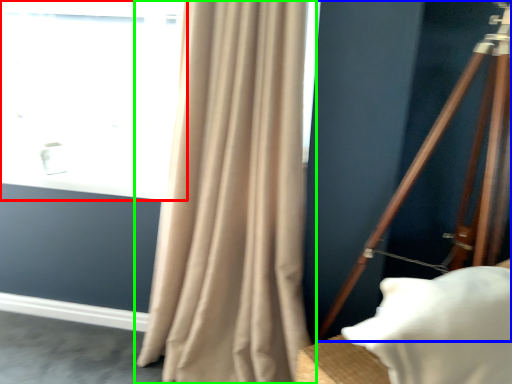
Question: Estimate the real-world distances between objects in this image. Which object is farther from window (highlighted by a red box), tripod (highlighted by a blue box) or curtain (highlighted by a green box)?

Choices:
 (A) tripod
 (B) curtain

Answer: (A)